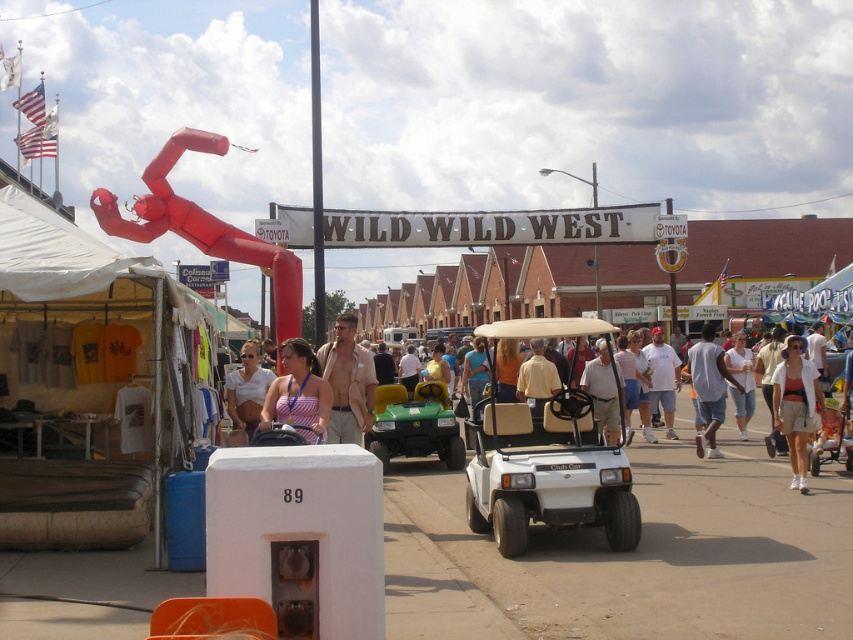
You are at the event and want to know which object takes up more space in the image. Based on the scene, can you determine which one between the white matte golf cart at center and the striped fabric tank top at center is larger in size?

The striped fabric tank top at center takes up more space in the image than the white matte golf cart at center, as the white matte golf cart at center occupies less space than striped fabric tank top at center according to the description.

You are attending an outdoor event and see two golf carts, the white matte golf cart at center and the green matte golf cart at center. Which one is positioned higher in the image?

The white matte golf cart at center is positioned higher in the image than the green matte golf cart at center, as it is located above it.